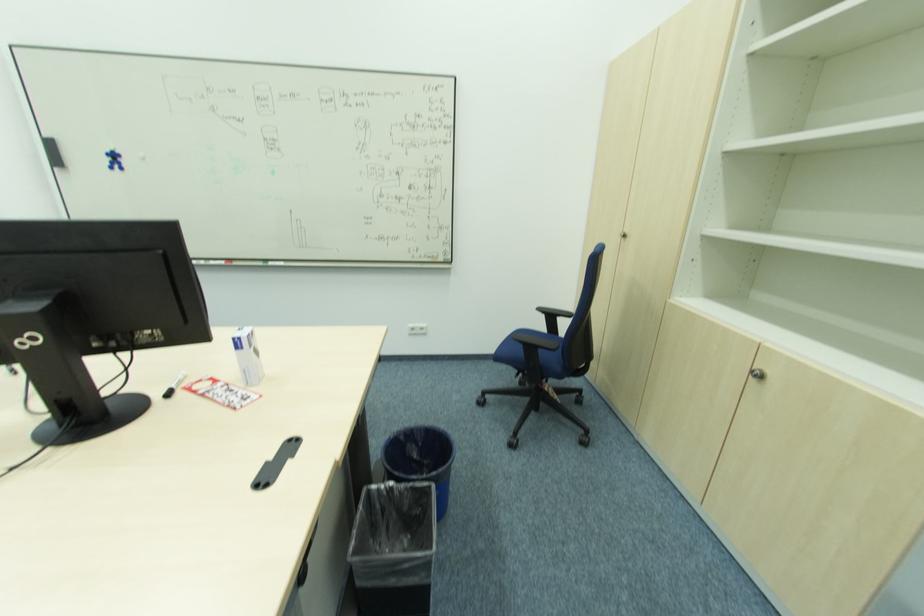
The image size is (924, 616). In order to click on black chair armrest in this screenshot , I will do `click(564, 333)`.